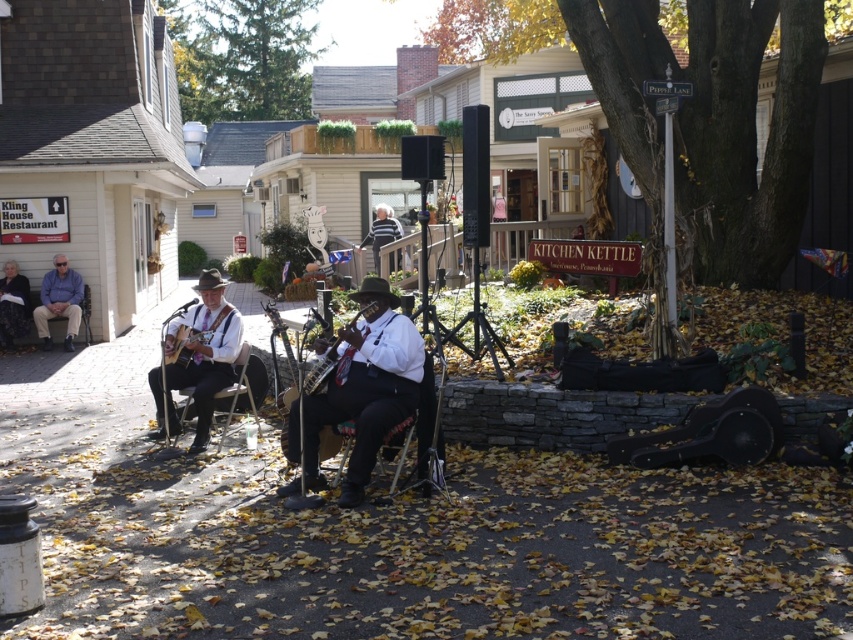
Consider the image. You are a stagehand setting up for a performance. You need to place a new microphone stand between the matte brown guitar at center and the matte blue shirt at left. Based on their sizes, will the stand fit comfortably between them?

The matte brown guitar at center might be wider than the matte blue shirt at left, so the microphone stand may not fit comfortably between them if the space is limited by the guitar width.

In the scene shown: You are a photographer standing at the origin point of the coordinate system. You want to take a photo of the matte brown guitar at center. What are the coordinates of the guitar?

The coordinates of the matte brown guitar at center are at point (358, 390).